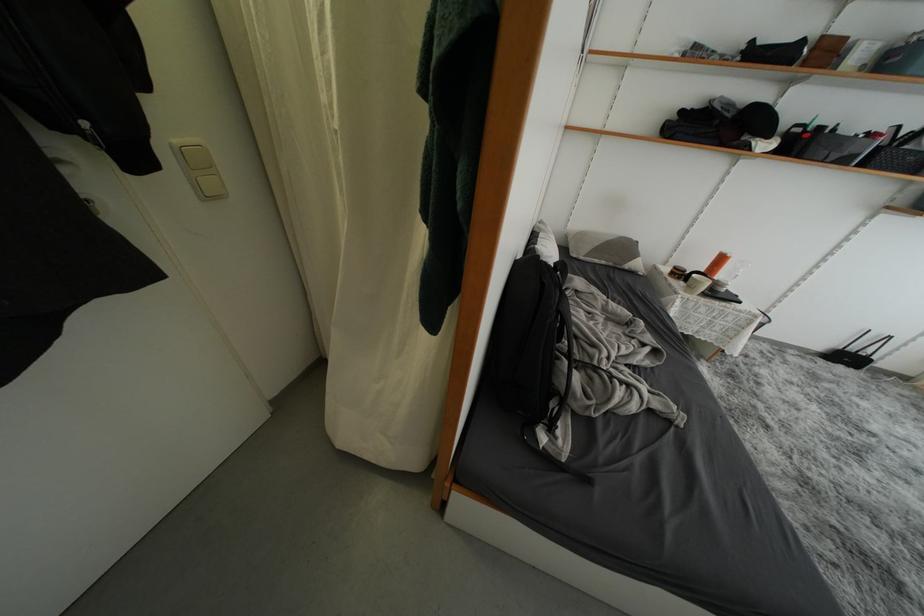
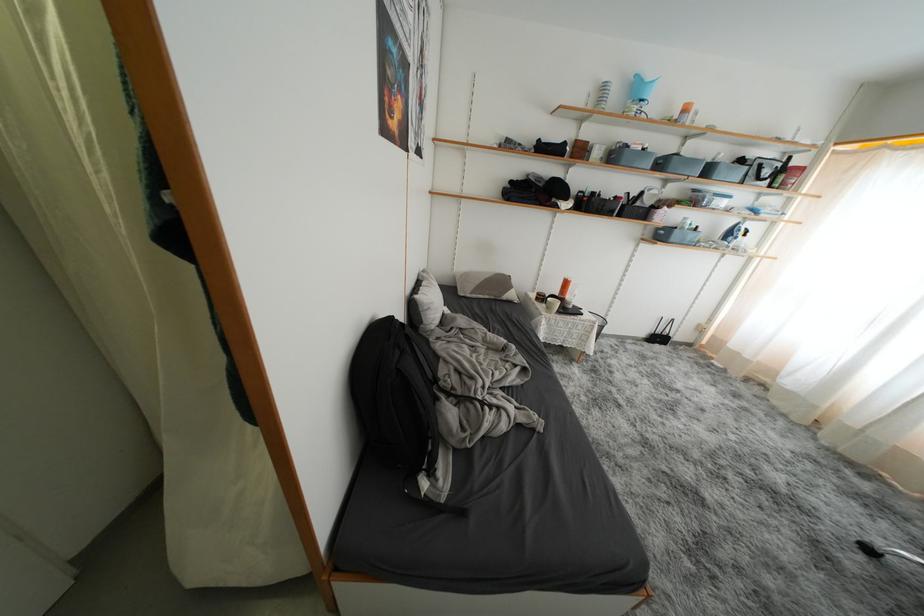
Find the pixel in the second image that matches (x=726, y=264) in the first image.

(572, 286)